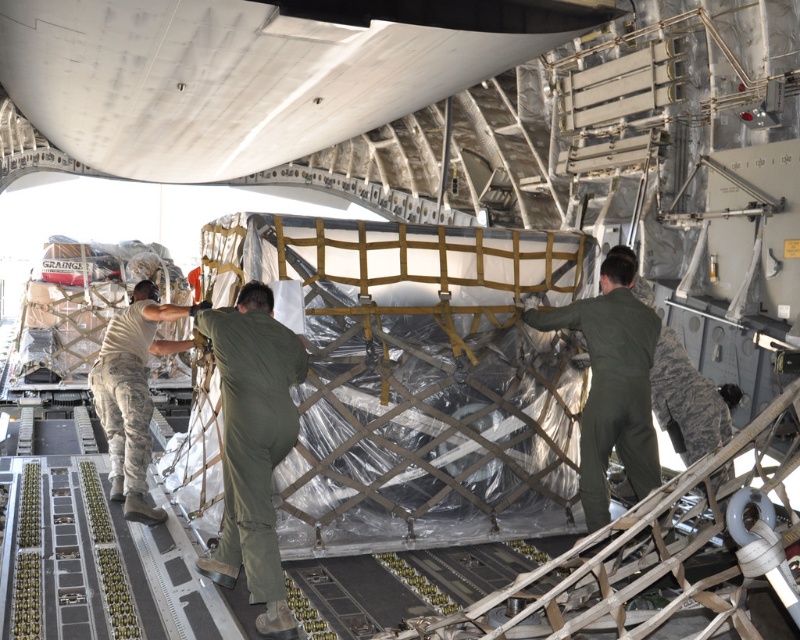
You are a military inspector checking the cargo loading process. You notice a point at coordinates (612, 385) in the image. What object is located at this point?

The point at coordinates (612, 385) corresponds to the green matte jumpsuit at center.